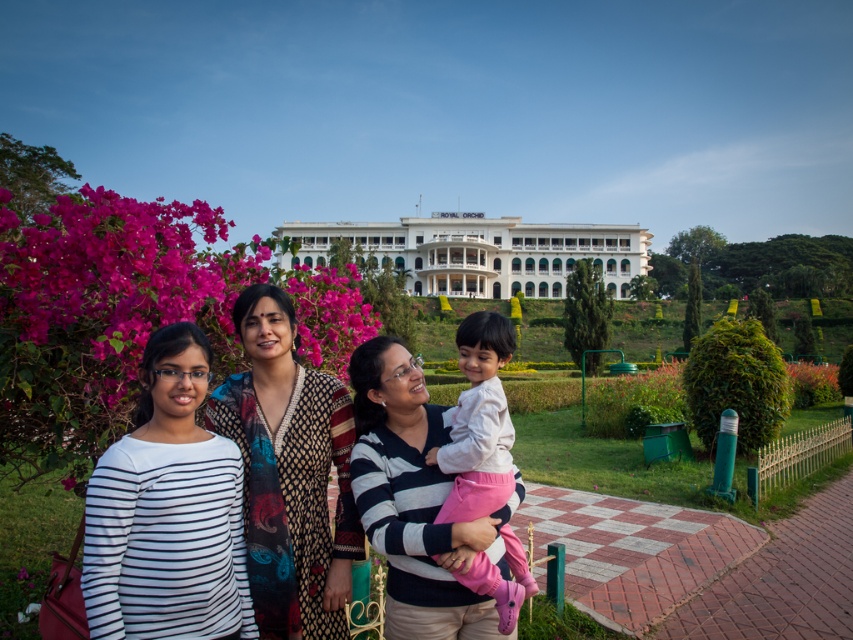
You are a photographer standing at the entrance of the building. You want to take a photo of the striped cotton shirt at center and the light pink fabric at center in the same frame. Given that your camera has a maximum focus range of 10 meters, will both subjects be in focus?

→ The distance between the striped cotton shirt at center and the light pink fabric at center is 11.32 meters, which exceeds the camera maximum focus range of 10 meters. Therefore, both subjects cannot be in focus at the same time.

You are standing in front of the ROYAL ORCHID building and want to take a photo of the group at point (207,504). If your camera has a maximum focus range of 60 meters, will you be able to focus on them?

The distance of point (207,504) from viewer is 58.95 meters, which is within the camera maximum focus range of 60 meters. So yes, you can focus on them.